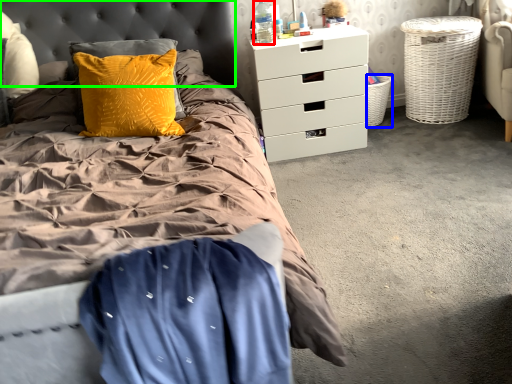
Question: Estimate the real-world distances between objects in this image. Which object is farther from bottle (highlighted by a red box), basket (highlighted by a blue box) or headboard (highlighted by a green box)?

Choices:
 (A) basket
 (B) headboard

Answer: (A)